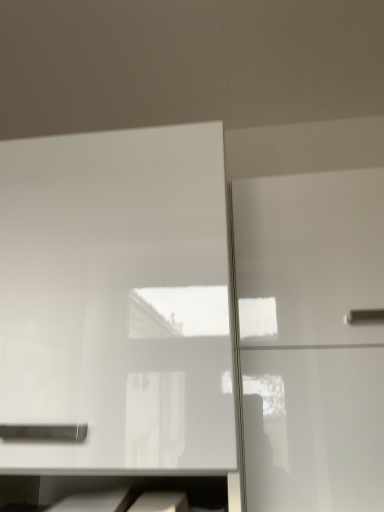
I want to click on white glossy cabinet at upper left, positioned as the 2th cabinetry in right-to-left order, so click(117, 302).

This screenshot has height=512, width=384. Describe the element at coordinates (117, 302) in the screenshot. I see `white glossy cabinet at upper left, the first cabinetry viewed from the left` at that location.

Describe the element at coordinates (312, 339) in the screenshot. Image resolution: width=384 pixels, height=512 pixels. I see `glossy white cabinet at right, the 2th cabinetry when ordered from left to right` at that location.

Identify the location of glossy white cabinet at right, the 2th cabinetry when ordered from left to right. The image size is (384, 512). (312, 339).

What are the coordinates of `white glossy cabinet at upper left, the first cabinetry viewed from the left` in the screenshot? It's located at (117, 302).

Which is more to the left, white glossy cabinet at upper left, the first cabinetry viewed from the left, or glossy white cabinet at right, the 2th cabinetry when ordered from left to right?

From the viewer's perspective, white glossy cabinet at upper left, the first cabinetry viewed from the left, appears more on the left side.

Which object is further away from the camera, white glossy cabinet at upper left, the first cabinetry viewed from the left, or glossy white cabinet at right, which is counted as the 1th cabinetry, starting from the right?

glossy white cabinet at right, which is counted as the 1th cabinetry, starting from the right, is behind.

Which is closer, [145,264] or [309,503]?

Point [145,264] is positioned closer to the camera compared to point [309,503].

From the image's perspective, would you say white glossy cabinet at upper left, the first cabinetry viewed from the left, is shown under glossy white cabinet at right, the 2th cabinetry when ordered from left to right?

No.

From a real-world perspective, is white glossy cabinet at upper left, positioned as the 2th cabinetry in right-to-left order, located beneath glossy white cabinet at right, which is counted as the 1th cabinetry, starting from the right?

Yes, from a real-world perspective, white glossy cabinet at upper left, positioned as the 2th cabinetry in right-to-left order, is beneath glossy white cabinet at right, which is counted as the 1th cabinetry, starting from the right.

Between white glossy cabinet at upper left, the first cabinetry viewed from the left, and glossy white cabinet at right, which is counted as the 1th cabinetry, starting from the right, which one has larger width?

Wider between the two is white glossy cabinet at upper left, the first cabinetry viewed from the left.

Between white glossy cabinet at upper left, the first cabinetry viewed from the left, and glossy white cabinet at right, which is counted as the 1th cabinetry, starting from the right, which one has less height?

Standing shorter between the two is glossy white cabinet at right, which is counted as the 1th cabinetry, starting from the right.

Can you confirm if white glossy cabinet at upper left, the first cabinetry viewed from the left, is smaller than glossy white cabinet at right, which is counted as the 1th cabinetry, starting from the right?

No.

Is white glossy cabinet at upper left, positioned as the 2th cabinetry in right-to-left order, not within glossy white cabinet at right, the 2th cabinetry when ordered from left to right?

Yes, white glossy cabinet at upper left, positioned as the 2th cabinetry in right-to-left order, is outside of glossy white cabinet at right, the 2th cabinetry when ordered from left to right.

Are white glossy cabinet at upper left, the first cabinetry viewed from the left, and glossy white cabinet at right, which is counted as the 1th cabinetry, starting from the right, located far from each other?

No, white glossy cabinet at upper left, the first cabinetry viewed from the left, is not far away from glossy white cabinet at right, which is counted as the 1th cabinetry, starting from the right.

In the scene shown: Could you tell me if white glossy cabinet at upper left, positioned as the 2th cabinetry in right-to-left order, is turned towards glossy white cabinet at right, which is counted as the 1th cabinetry, starting from the right?

No, white glossy cabinet at upper left, positioned as the 2th cabinetry in right-to-left order, is not oriented towards glossy white cabinet at right, which is counted as the 1th cabinetry, starting from the right.

Looking at this image, how different are the orientations of white glossy cabinet at upper left, positioned as the 2th cabinetry in right-to-left order, and glossy white cabinet at right, which is counted as the 1th cabinetry, starting from the right, in degrees?

They differ by 1.06 degrees in their facing directions.

Could you measure the distance between white glossy cabinet at upper left, positioned as the 2th cabinetry in right-to-left order, and glossy white cabinet at right, which is counted as the 1th cabinetry, starting from the right?

The distance of white glossy cabinet at upper left, positioned as the 2th cabinetry in right-to-left order, from glossy white cabinet at right, which is counted as the 1th cabinetry, starting from the right, is 11.58 inches.

Where is `cabinetry that appears below the white glossy cabinet at upper left, the first cabinetry viewed from the left (from the image's perspective)`? The height and width of the screenshot is (512, 384). cabinetry that appears below the white glossy cabinet at upper left, the first cabinetry viewed from the left (from the image's perspective) is located at coordinates (312, 339).

Considering the relative positions of glossy white cabinet at right, which is counted as the 1th cabinetry, starting from the right, and white glossy cabinet at upper left, the first cabinetry viewed from the left, in the image provided, is glossy white cabinet at right, which is counted as the 1th cabinetry, starting from the right, to the left or to the right of white glossy cabinet at upper left, the first cabinetry viewed from the left,?

glossy white cabinet at right, which is counted as the 1th cabinetry, starting from the right, is positioned on white glossy cabinet at upper left, the first cabinetry viewed from the left,'s right side.

Relative to white glossy cabinet at upper left, positioned as the 2th cabinetry in right-to-left order, is glossy white cabinet at right, the 2th cabinetry when ordered from left to right, in front or behind?

glossy white cabinet at right, the 2th cabinetry when ordered from left to right, is positioned farther from the viewer than white glossy cabinet at upper left, positioned as the 2th cabinetry in right-to-left order.

Is point (265, 422) positioned before point (58, 417)?

No, (265, 422) is further to viewer.

From the image's perspective, would you say glossy white cabinet at right, which is counted as the 1th cabinetry, starting from the right, is shown under white glossy cabinet at upper left, the first cabinetry viewed from the left?

Yes, from the image's perspective, glossy white cabinet at right, which is counted as the 1th cabinetry, starting from the right, is beneath white glossy cabinet at upper left, the first cabinetry viewed from the left.

From a real-world perspective, is glossy white cabinet at right, the 2th cabinetry when ordered from left to right, physically located above or below white glossy cabinet at upper left, the first cabinetry viewed from the left?

Clearly, from a real-world perspective, glossy white cabinet at right, the 2th cabinetry when ordered from left to right, is above white glossy cabinet at upper left, the first cabinetry viewed from the left.

In terms of width, does glossy white cabinet at right, which is counted as the 1th cabinetry, starting from the right, look wider or thinner when compared to white glossy cabinet at upper left, positioned as the 2th cabinetry in right-to-left order?

Considering their sizes, glossy white cabinet at right, which is counted as the 1th cabinetry, starting from the right, looks slimmer than white glossy cabinet at upper left, positioned as the 2th cabinetry in right-to-left order.

Is glossy white cabinet at right, which is counted as the 1th cabinetry, starting from the right, taller than white glossy cabinet at upper left, the first cabinetry viewed from the left?

Incorrect, the height of glossy white cabinet at right, which is counted as the 1th cabinetry, starting from the right, is not larger of that of white glossy cabinet at upper left, the first cabinetry viewed from the left.

Is glossy white cabinet at right, the 2th cabinetry when ordered from left to right, bigger than white glossy cabinet at upper left, positioned as the 2th cabinetry in right-to-left order?

Incorrect, glossy white cabinet at right, the 2th cabinetry when ordered from left to right, is not larger than white glossy cabinet at upper left, positioned as the 2th cabinetry in right-to-left order.

Is glossy white cabinet at right, which is counted as the 1th cabinetry, starting from the right, inside or outside of white glossy cabinet at upper left, the first cabinetry viewed from the left?

glossy white cabinet at right, which is counted as the 1th cabinetry, starting from the right, cannot be found inside white glossy cabinet at upper left, the first cabinetry viewed from the left.

Would you consider glossy white cabinet at right, the 2th cabinetry when ordered from left to right, to be distant from white glossy cabinet at upper left, positioned as the 2th cabinetry in right-to-left order?

No, glossy white cabinet at right, the 2th cabinetry when ordered from left to right, is not far from white glossy cabinet at upper left, positioned as the 2th cabinetry in right-to-left order.

Is glossy white cabinet at right, which is counted as the 1th cabinetry, starting from the right, turned away from white glossy cabinet at upper left, positioned as the 2th cabinetry in right-to-left order?

No.

How far apart are glossy white cabinet at right, which is counted as the 1th cabinetry, starting from the right, and white glossy cabinet at upper left, the first cabinetry viewed from the left?

A distance of 11.58 inches exists between glossy white cabinet at right, which is counted as the 1th cabinetry, starting from the right, and white glossy cabinet at upper left, the first cabinetry viewed from the left.

This screenshot has height=512, width=384. Find the location of `cabinetry that appears above the glossy white cabinet at right, the 2th cabinetry when ordered from left to right (from the image's perspective)`. cabinetry that appears above the glossy white cabinet at right, the 2th cabinetry when ordered from left to right (from the image's perspective) is located at coordinates (117, 302).

Identify the location of cabinetry in front of the glossy white cabinet at right, which is counted as the 1th cabinetry, starting from the right. The image size is (384, 512). (117, 302).

This screenshot has height=512, width=384. Find the location of `cabinetry located behind the white glossy cabinet at upper left, the first cabinetry viewed from the left`. cabinetry located behind the white glossy cabinet at upper left, the first cabinetry viewed from the left is located at coordinates (312, 339).